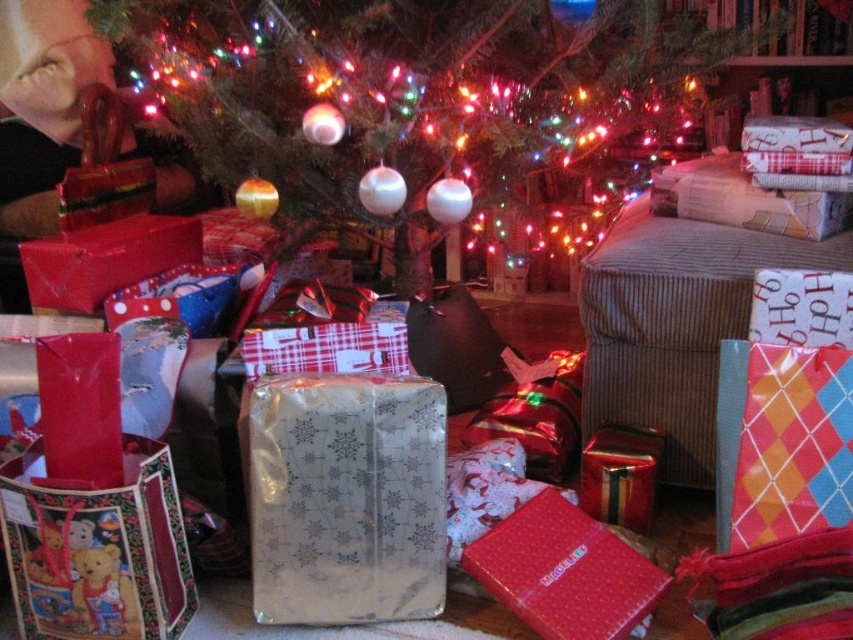
Question: Considering the real-world distances, which object is farthest from the matte red gift at center?

Choices:
 (A) shiny green tree at center
 (B) silver metallic gift wrap at center
 (C) shiny metallic gift at center

Answer: (A)

Question: Does matte red gift at center have a larger size compared to shiny metallic gift at center?

Choices:
 (A) no
 (B) yes

Answer: (B)

Question: Among these points, which one is farthest from the camera?

Choices:
 (A) (358, 557)
 (B) (189, 600)
 (C) (529, 545)

Answer: (C)

Question: Which of the following is the farthest from the observer?

Choices:
 (A) (657, 579)
 (B) (399, 456)
 (C) (119, 486)
 (D) (300, 141)

Answer: (D)

Question: Does teddy bear print fabric bag at lower left appear on the left side of shiny metallic gift at center?

Choices:
 (A) no
 (B) yes

Answer: (B)

Question: Does matte red gift at center appear over shiny metallic gift at center?

Choices:
 (A) no
 (B) yes

Answer: (A)